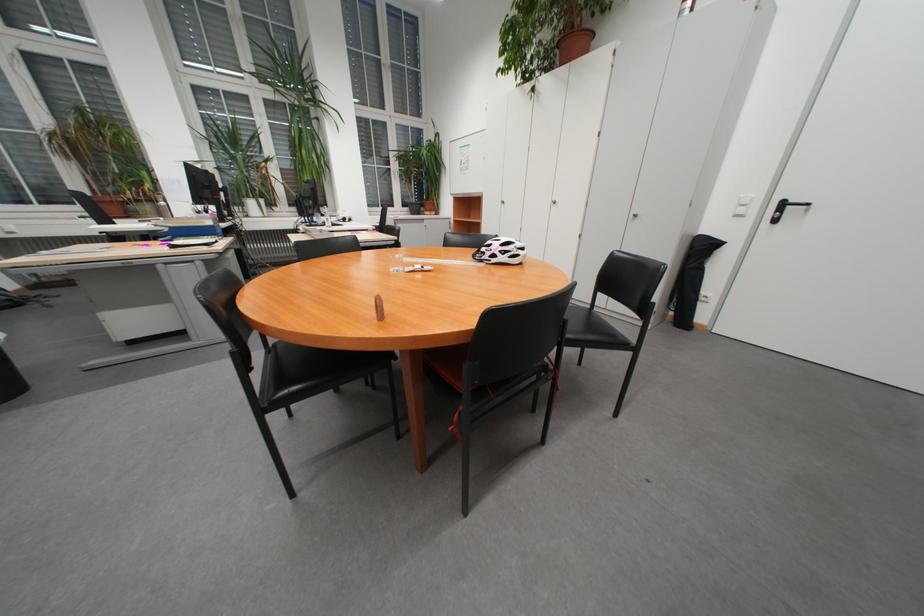
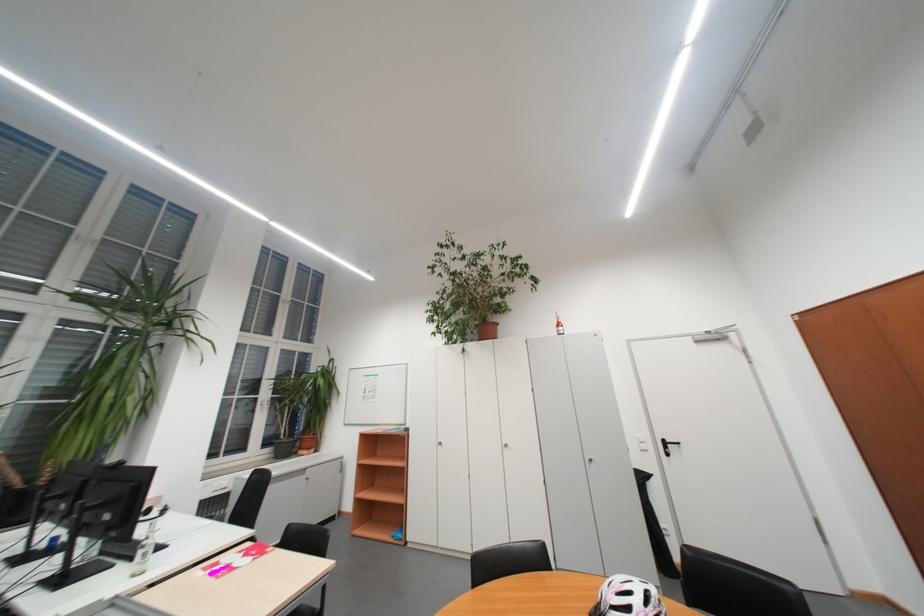
Where in the second image is the point corresponding to [408,177] from the first image?

(277, 408)